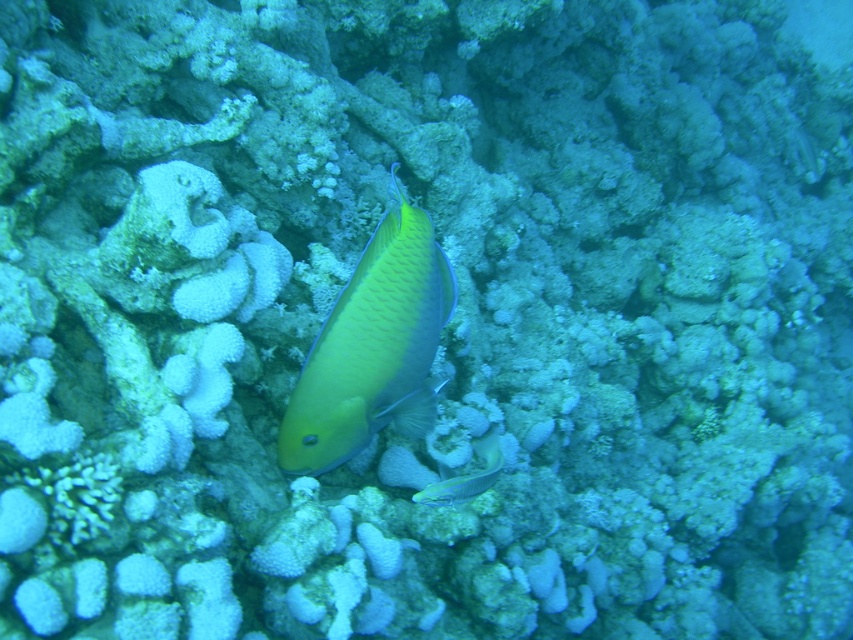
Which is in front, point (405, 273) or point (490, 474)?

Positioned in front is point (405, 273).

Measure the distance between yellow matte fish at center and shiny blue fish at center.

20.55 centimeters

Who is more forward, [397,237] or [462,499]?

Point [397,237] is in front.

Identify the location of yellow matte fish at center. Image resolution: width=853 pixels, height=640 pixels. (372, 346).